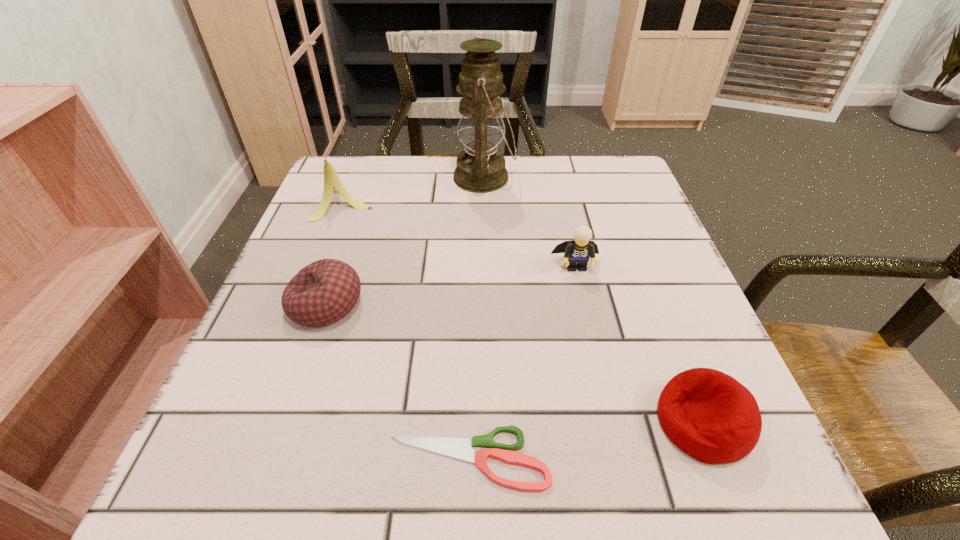
This screenshot has width=960, height=540. What are the coordinates of `the tallest object` in the screenshot? It's located at (480, 169).

Find the location of a particular element. banana is located at coordinates (332, 182).

This screenshot has height=540, width=960. Identify the location of the third farthest object. (579, 251).

At what (x,y) coordinates should I click in order to perform the action: click on Lego. Please return your answer as a coordinate pair (x, y). The height and width of the screenshot is (540, 960). Looking at the image, I should click on 579,251.

Locate an element on the screen. the farther beanbag is located at coordinates (325, 291).

At what (x,y) coordinates should I click in order to perform the action: click on the left beanbag. Please return your answer as a coordinate pair (x, y). Image resolution: width=960 pixels, height=540 pixels. Looking at the image, I should click on (325, 291).

This screenshot has height=540, width=960. Identify the location of the right beanbag. (709, 415).

Find the location of a particular element. the nearer beanbag is located at coordinates [709, 415].

I want to click on the shortest object, so click(461, 449).

Image resolution: width=960 pixels, height=540 pixels. Identify the location of free location located 0.240m on the right of the tallest object. (613, 178).